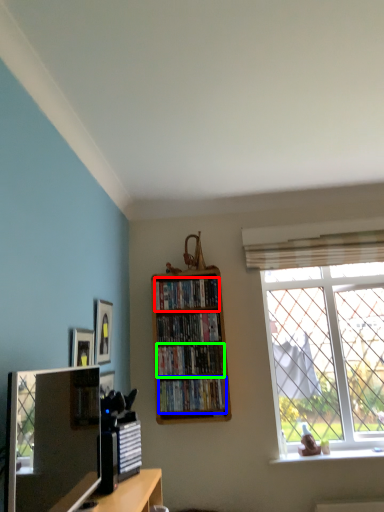
Question: Based on their relative distances, which object is farther from book (highlighted by a red box)? Choose from book (highlighted by a blue box) and book (highlighted by a green box).

Choices:
 (A) book
 (B) book

Answer: (A)